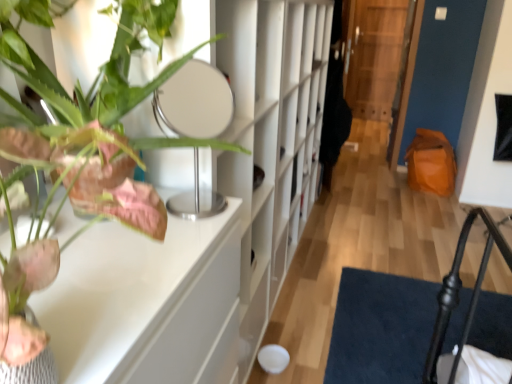
The height and width of the screenshot is (384, 512). Find the location of `transparent wooden door at center`. transparent wooden door at center is located at coordinates (379, 61).

What do you see at coordinates (379, 61) in the screenshot?
I see `transparent wooden door at center` at bounding box center [379, 61].

What do you see at coordinates (146, 303) in the screenshot?
I see `white glossy table at upper left` at bounding box center [146, 303].

Image resolution: width=512 pixels, height=384 pixels. Find the location of `green matte plant at upper left`. green matte plant at upper left is located at coordinates (98, 219).

Considering the sizes of objects transparent wooden door at center and white matte bookshelf at center in the image provided, who is taller, transparent wooden door at center or white matte bookshelf at center?

transparent wooden door at center is taller.

From a real-world perspective, is transparent wooden door at center positioned above or below white matte bookshelf at center?

From a real-world perspective, transparent wooden door at center is physically above white matte bookshelf at center.

Based on the photo, can you confirm if transparent wooden door at center is smaller than white matte bookshelf at center?

Yes, transparent wooden door at center is smaller than white matte bookshelf at center.

Is white matte bookshelf at center inside transparent wooden door at center?

No, white matte bookshelf at center is not surrounded by transparent wooden door at center.

Image resolution: width=512 pixels, height=384 pixels. Find the location of `bookshelf on the right of the green matte plant at upper left`. bookshelf on the right of the green matte plant at upper left is located at coordinates point(271,140).

Would you say green matte plant at upper left is inside or outside white matte bookshelf at center?

The correct answer is: outside.

Can you confirm if green matte plant at upper left is thinner than white matte bookshelf at center?

Incorrect, the width of green matte plant at upper left is not less than that of white matte bookshelf at center.

From a real-world perspective, which object rests below the other?

white matte bookshelf at center, from a real-world perspective.

Between white glossy table at upper left and green matte plant at upper left, which one has smaller width?

white glossy table at upper left.

Considering the sizes of white glossy table at upper left and green matte plant at upper left in the image, is white glossy table at upper left bigger or smaller than green matte plant at upper left?

Clearly, white glossy table at upper left is larger in size than green matte plant at upper left.

How different are the orientations of transparent wooden door at center and white glossy table at upper left in degrees?

There is a 89.1-degree angle between the facing directions of transparent wooden door at center and white glossy table at upper left.

Between transparent wooden door at center and white glossy table at upper left, which one appears on the left side from the viewer's perspective?

From the viewer's perspective, white glossy table at upper left appears more on the left side.

Is transparent wooden door at center touching white glossy table at upper left?

transparent wooden door at center is not next to white glossy table at upper left, and they're not touching.

From their relative heights in the image, would you say white matte bookshelf at center is taller or shorter than white glossy table at upper left?

In the image, white matte bookshelf at center appears to be taller than white glossy table at upper left.

Considering the relative positions of white matte bookshelf at center and white glossy table at upper left in the image provided, is white matte bookshelf at center to the left or to the right of white glossy table at upper left?

white matte bookshelf at center is to the right of white glossy table at upper left.

Considering the positions of point (294, 90) and point (148, 267), is point (294, 90) closer or farther from the camera than point (148, 267)?

Point (294, 90) is farther from the camera than point (148, 267).

Can you confirm if white matte bookshelf at center is wider than white glossy table at upper left?

In fact, white matte bookshelf at center might be narrower than white glossy table at upper left.

Could you tell me if green matte plant at upper left is turned towards white glossy table at upper left?

No.

Does point (9, 377) appear closer or farther from the camera than point (67, 370)?

Clearly, point (9, 377) is closer to the camera than point (67, 370).

Considering the relative positions of green matte plant at upper left and white glossy table at upper left in the image provided, is green matte plant at upper left to the right of white glossy table at upper left from the viewer's perspective?

Yes.

The width and height of the screenshot is (512, 384). In order to click on houseplant located in front of the white glossy table at upper left in this screenshot , I will do `click(98, 219)`.

Measure the distance from transparent wooden door at center to green matte plant at upper left.

transparent wooden door at center and green matte plant at upper left are 5.25 meters apart.

From a real-world perspective, is transparent wooden door at center physically located above or below green matte plant at upper left?

transparent wooden door at center is below green matte plant at upper left.

Between transparent wooden door at center and green matte plant at upper left, which one has smaller width?

With smaller width is transparent wooden door at center.

Is transparent wooden door at center far from green matte plant at upper left?

transparent wooden door at center is positioned a significant distance from green matte plant at upper left.

The height and width of the screenshot is (384, 512). What are the coordinates of `glass door above the white matte bookshelf at center (from the image's perspective)` in the screenshot? It's located at (379, 61).

The width and height of the screenshot is (512, 384). Find the location of `bookshelf that appears behind the green matte plant at upper left`. bookshelf that appears behind the green matte plant at upper left is located at coordinates (271, 140).

Considering their positions, is white glossy table at upper left positioned closer to green matte plant at upper left than white matte bookshelf at center?

white glossy table at upper left.

Considering their positions, is transparent wooden door at center positioned closer to white glossy table at upper left than white matte bookshelf at center?

The object closer to white glossy table at upper left is white matte bookshelf at center.

From the image, which object appears to be farther from green matte plant at upper left, white glossy table at upper left or transparent wooden door at center?

transparent wooden door at center is positioned further to the anchor green matte plant at upper left.

Which object lies nearer to the anchor point white matte bookshelf at center, transparent wooden door at center or green matte plant at upper left?

Based on the image, green matte plant at upper left appears to be nearer to white matte bookshelf at center.

Estimate the real-world distances between objects in this image. Which object is closer to transparent wooden door at center, white glossy table at upper left or white matte bookshelf at center?

white matte bookshelf at center lies closer to transparent wooden door at center than the other object.

Which object lies nearer to the anchor point white glossy table at upper left, green matte plant at upper left or white matte bookshelf at center?

Based on the image, green matte plant at upper left appears to be nearer to white glossy table at upper left.

Looking at the image, which one is located closer to transparent wooden door at center, white matte bookshelf at center or white glossy table at upper left?

white matte bookshelf at center is positioned closer to the anchor transparent wooden door at center.

From the image, which object appears to be nearer to white matte bookshelf at center, white glossy table at upper left or transparent wooden door at center?

Among the two, white glossy table at upper left is located nearer to white matte bookshelf at center.

Where is `table between green matte plant at upper left and white matte bookshelf at center from front to back`? This screenshot has width=512, height=384. table between green matte plant at upper left and white matte bookshelf at center from front to back is located at coordinates (146, 303).

Find the location of `table positioned between green matte plant at upper left and transparent wooden door at center from near to far`. table positioned between green matte plant at upper left and transparent wooden door at center from near to far is located at coordinates (146, 303).

I want to click on bookshelf located between white glossy table at upper left and transparent wooden door at center in the depth direction, so click(271, 140).

Where is `bookshelf located between green matte plant at upper left and transparent wooden door at center in the depth direction`? This screenshot has width=512, height=384. bookshelf located between green matte plant at upper left and transparent wooden door at center in the depth direction is located at coordinates (271, 140).